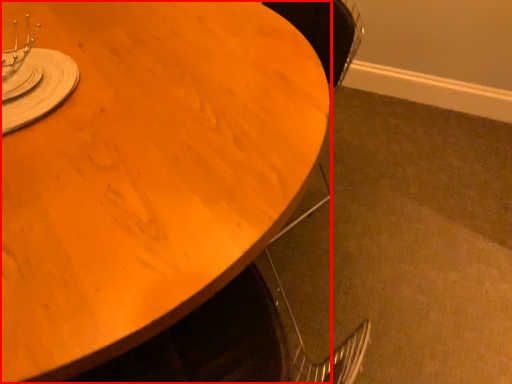
Question: Observing the image, what is the correct spatial positioning of table (annotated by the red box) in reference to tableware?

Choices:
 (A) right
 (B) left

Answer: (A)